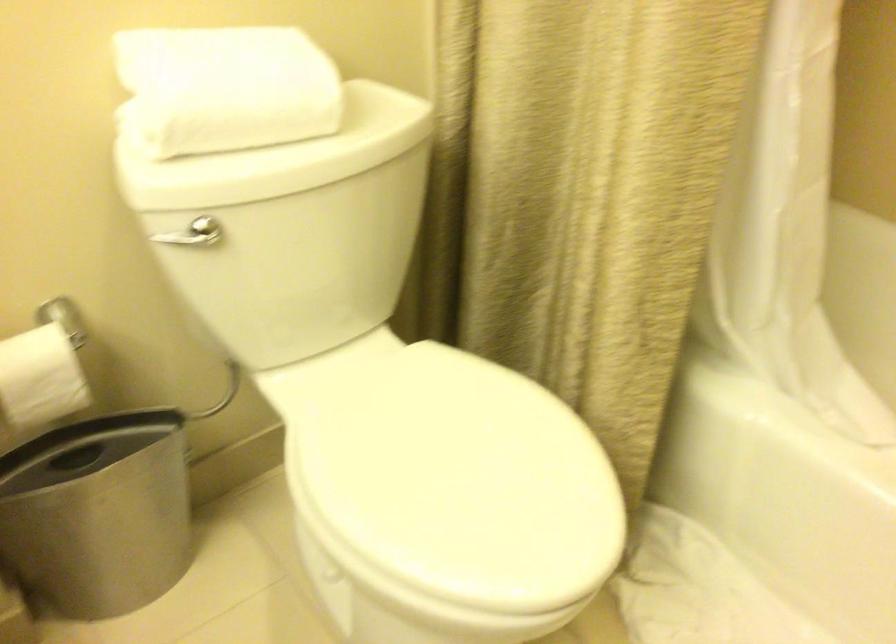
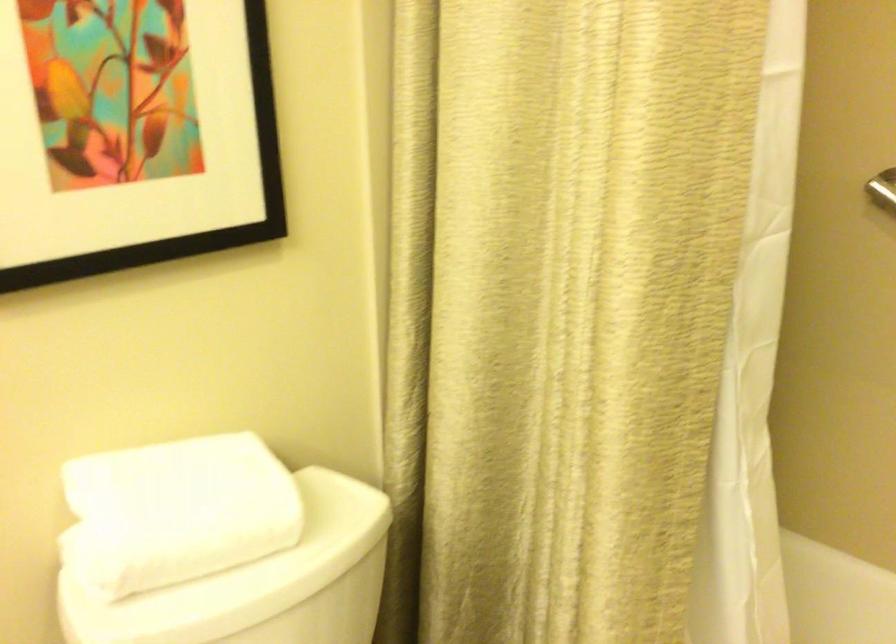
Question: The first image is from the beginning of the video and the second image is from the end. How did the camera likely rotate when shooting the video?

Choices:
 (A) Left
 (B) Right
 (C) Up
 (D) Down

Answer: (C)